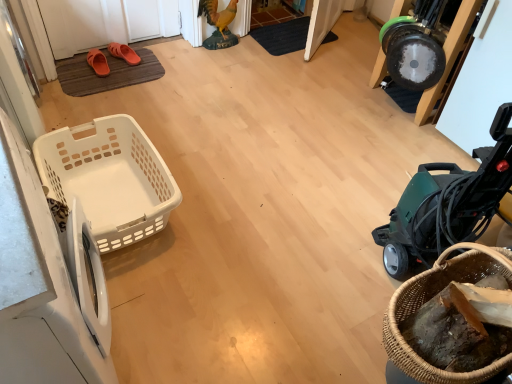
You are a GUI agent. You are given a task and a screenshot of the screen. Output one action in this format:
    pyautogui.click(x=<x>, y=<y>)
    Task: Click on the vacant area to the right of white plastic basket at left, the 2th basket in the right-to-left sequence
    The width and height of the screenshot is (512, 384).
    Given the screenshot: What is the action you would take?
    pyautogui.click(x=230, y=221)